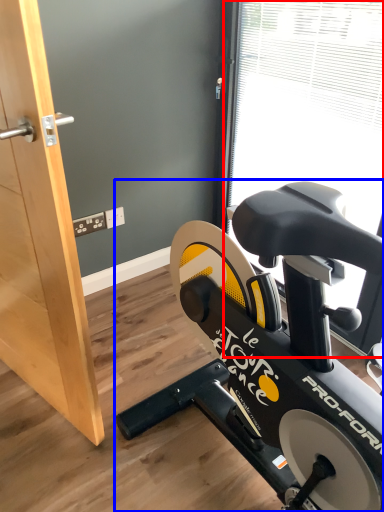
Question: Which object appears farthest to the camera in this image, window screen (highlighted by a red box) or stationary bicycle (highlighted by a blue box)?

Choices:
 (A) window screen
 (B) stationary bicycle

Answer: (A)